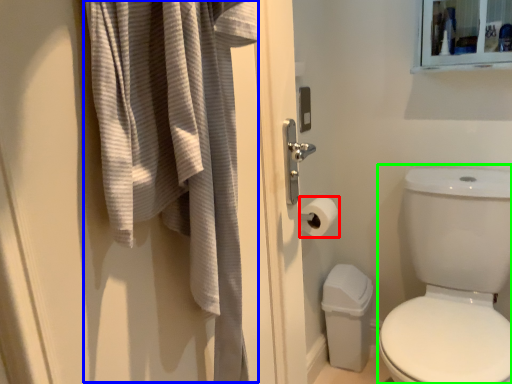
Question: Which object is positioned farthest from toilet paper (highlighted by a red box)? Select from bath towel (highlighted by a blue box) and toilet bowl (highlighted by a green box).

Choices:
 (A) bath towel
 (B) toilet bowl

Answer: (A)